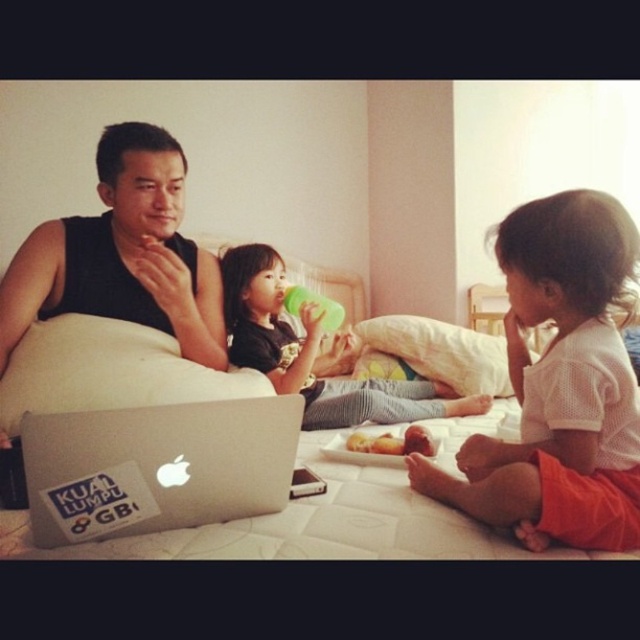
Question: Where is silver metallic laptop at lower left located in relation to matte black shirt at center in the image?

Choices:
 (A) above
 (B) below

Answer: (B)

Question: Can you confirm if white textured shirt at center is positioned above white fabric bed at center?

Choices:
 (A) no
 (B) yes

Answer: (B)

Question: Is white textured shirt at center to the left of matte black shirt at center from the viewer's perspective?

Choices:
 (A) yes
 (B) no

Answer: (B)

Question: Among these points, which one is nearest to the camera?

Choices:
 (A) (541, 392)
 (B) (157, 326)
 (C) (33, 435)
 (D) (365, 387)

Answer: (C)

Question: Considering the real-world distances, which object is closest to the silver metallic laptop at lower left?

Choices:
 (A) white textured shirt at center
 (B) white fabric bed at center

Answer: (B)

Question: Estimate the real-world distances between objects in this image. Which object is farther from the white textured shirt at center?

Choices:
 (A) black matte tank top at center
 (B) matte black shirt at center

Answer: (A)